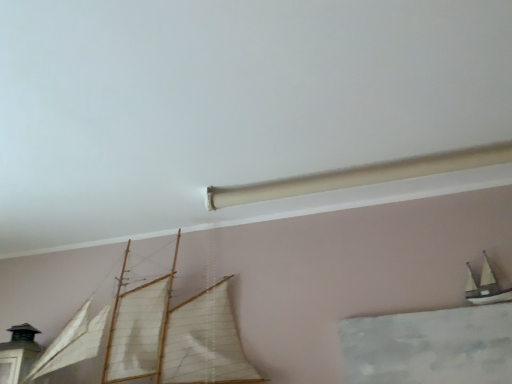
What do you see at coordinates (485, 286) in the screenshot? I see `white matte sailboat at upper right, placed as the second boat when sorted from left to right` at bounding box center [485, 286].

Locate an element on the screen. The height and width of the screenshot is (384, 512). white matte sailboat at upper right, placed as the second boat when sorted from left to right is located at coordinates click(485, 286).

What is the approximate width of wooden sailboat at center, the 1th boat positioned from the left?

The width of wooden sailboat at center, the 1th boat positioned from the left, is 9.74 inches.

Identify the location of wooden sailboat at center, the 2th boat viewed from the right. (174, 334).

Describe the element at coordinates (174, 334) in the screenshot. This screenshot has height=384, width=512. I see `wooden sailboat at center, the 2th boat viewed from the right` at that location.

Identify the location of white matte sailboat at upper right, placed as the second boat when sorted from left to right. The width and height of the screenshot is (512, 384). (485, 286).

Between white matte sailboat at upper right, arranged as the 1th boat when viewed from the right, and wooden sailboat at center, the 2th boat viewed from the right, which one appears on the right side from the viewer's perspective?

white matte sailboat at upper right, arranged as the 1th boat when viewed from the right, is more to the right.

Does white matte sailboat at upper right, placed as the second boat when sorted from left to right, lie behind wooden sailboat at center, the 2th boat viewed from the right?

Yes, the depth of white matte sailboat at upper right, placed as the second boat when sorted from left to right, is greater than that of wooden sailboat at center, the 2th boat viewed from the right.

Is point (473, 292) closer or farther from the camera than point (117, 379)?

Clearly, point (473, 292) is more distant from the camera than point (117, 379).

From the image's perspective, would you say white matte sailboat at upper right, arranged as the 1th boat when viewed from the right, is shown under wooden sailboat at center, the 1th boat positioned from the left?

Actually, white matte sailboat at upper right, arranged as the 1th boat when viewed from the right, appears above wooden sailboat at center, the 1th boat positioned from the left, in the image.

From a real-world perspective, relative to wooden sailboat at center, the 1th boat positioned from the left, is white matte sailboat at upper right, arranged as the 1th boat when viewed from the right, vertically above or below?

white matte sailboat at upper right, arranged as the 1th boat when viewed from the right, is below wooden sailboat at center, the 1th boat positioned from the left.

Which object is wider, white matte sailboat at upper right, placed as the second boat when sorted from left to right, or wooden sailboat at center, the 1th boat positioned from the left?

With larger width is wooden sailboat at center, the 1th boat positioned from the left.

Does white matte sailboat at upper right, arranged as the 1th boat when viewed from the right, have a lesser height compared to wooden sailboat at center, the 1th boat positioned from the left?

Indeed, white matte sailboat at upper right, arranged as the 1th boat when viewed from the right, has a lesser height compared to wooden sailboat at center, the 1th boat positioned from the left.

Considering the sizes of objects white matte sailboat at upper right, arranged as the 1th boat when viewed from the right, and wooden sailboat at center, the 1th boat positioned from the left, in the image provided, who is bigger, white matte sailboat at upper right, arranged as the 1th boat when viewed from the right, or wooden sailboat at center, the 1th boat positioned from the left,?

wooden sailboat at center, the 1th boat positioned from the left.

Choose the correct answer: Is white matte sailboat at upper right, arranged as the 1th boat when viewed from the right, inside wooden sailboat at center, the 1th boat positioned from the left, or outside it?

white matte sailboat at upper right, arranged as the 1th boat when viewed from the right, is spatially situated outside wooden sailboat at center, the 1th boat positioned from the left.

Is white matte sailboat at upper right, placed as the second boat when sorted from left to right, beside wooden sailboat at center, the 1th boat positioned from the left?

No, white matte sailboat at upper right, placed as the second boat when sorted from left to right, is not making contact with wooden sailboat at center, the 1th boat positioned from the left.

Is white matte sailboat at upper right, arranged as the 1th boat when viewed from the right, looking in the opposite direction of wooden sailboat at center, the 2th boat viewed from the right?

That's not correct — white matte sailboat at upper right, arranged as the 1th boat when viewed from the right, is not looking away from wooden sailboat at center, the 2th boat viewed from the right.

What's the angular difference between white matte sailboat at upper right, placed as the second boat when sorted from left to right, and wooden sailboat at center, the 2th boat viewed from the right,'s facing directions?

white matte sailboat at upper right, placed as the second boat when sorted from left to right, and wooden sailboat at center, the 2th boat viewed from the right, are facing 0.49 degrees away from each other.

Measure the distance from white matte sailboat at upper right, arranged as the 1th boat when viewed from the right, to wooden sailboat at center, the 2th boat viewed from the right.

The distance of white matte sailboat at upper right, arranged as the 1th boat when viewed from the right, from wooden sailboat at center, the 2th boat viewed from the right, is 3.62 feet.

You are a GUI agent. You are given a task and a screenshot of the screen. Output one action in this format:
    pyautogui.click(x=<x>, y=<y>)
    Task: Click on the boat in front of the white matte sailboat at upper right, arranged as the 1th boat when viewed from the right
    The height and width of the screenshot is (384, 512).
    Given the screenshot: What is the action you would take?
    pyautogui.click(x=174, y=334)

Considering the relative positions of wooden sailboat at center, the 2th boat viewed from the right, and white matte sailboat at upper right, arranged as the 1th boat when viewed from the right, in the image provided, is wooden sailboat at center, the 2th boat viewed from the right, to the left or to the right of white matte sailboat at upper right, arranged as the 1th boat when viewed from the right,?

From the image, it's evident that wooden sailboat at center, the 2th boat viewed from the right, is to the left of white matte sailboat at upper right, arranged as the 1th boat when viewed from the right.

Which is in front, wooden sailboat at center, the 1th boat positioned from the left, or white matte sailboat at upper right, arranged as the 1th boat when viewed from the right?

wooden sailboat at center, the 1th boat positioned from the left, is closer to the camera.

Considering the points (215, 335) and (473, 280), which point is in front, point (215, 335) or point (473, 280)?

Point (473, 280)

From the image's perspective, who appears lower, wooden sailboat at center, the 1th boat positioned from the left, or white matte sailboat at upper right, arranged as the 1th boat when viewed from the right?

wooden sailboat at center, the 1th boat positioned from the left, appears lower in the image.

From a real-world perspective, is wooden sailboat at center, the 1th boat positioned from the left, above or below white matte sailboat at upper right, placed as the second boat when sorted from left to right?

From a real-world perspective, wooden sailboat at center, the 1th boat positioned from the left, is physically above white matte sailboat at upper right, placed as the second boat when sorted from left to right.

Can you confirm if wooden sailboat at center, the 2th boat viewed from the right, is thinner than white matte sailboat at upper right, placed as the second boat when sorted from left to right?

No, wooden sailboat at center, the 2th boat viewed from the right, is not thinner than white matte sailboat at upper right, placed as the second boat when sorted from left to right.

Who is taller, wooden sailboat at center, the 2th boat viewed from the right, or white matte sailboat at upper right, placed as the second boat when sorted from left to right?

Standing taller between the two is wooden sailboat at center, the 2th boat viewed from the right.

Is wooden sailboat at center, the 2th boat viewed from the right, bigger than white matte sailboat at upper right, placed as the second boat when sorted from left to right?

Correct, wooden sailboat at center, the 2th boat viewed from the right, is larger in size than white matte sailboat at upper right, placed as the second boat when sorted from left to right.

Is white matte sailboat at upper right, placed as the second boat when sorted from left to right, located within wooden sailboat at center, the 1th boat positioned from the left?

No.

Is wooden sailboat at center, the 2th boat viewed from the right, positioned far away from white matte sailboat at upper right, placed as the second boat when sorted from left to right?

wooden sailboat at center, the 2th boat viewed from the right, is positioned a significant distance from white matte sailboat at upper right, placed as the second boat when sorted from left to right.

Is wooden sailboat at center, the 2th boat viewed from the right, oriented away from white matte sailboat at upper right, placed as the second boat when sorted from left to right?

No, wooden sailboat at center, the 2th boat viewed from the right, is not facing the opposite direction of white matte sailboat at upper right, placed as the second boat when sorted from left to right.

What's the angular difference between wooden sailboat at center, the 1th boat positioned from the left, and white matte sailboat at upper right, placed as the second boat when sorted from left to right,'s facing directions?

0.49 degrees.

Could you measure the distance between wooden sailboat at center, the 1th boat positioned from the left, and white matte sailboat at upper right, placed as the second boat when sorted from left to right?

wooden sailboat at center, the 1th boat positioned from the left, and white matte sailboat at upper right, placed as the second boat when sorted from left to right, are 3.62 feet apart from each other.

The height and width of the screenshot is (384, 512). Identify the location of boat that is on the right side of wooden sailboat at center, the 1th boat positioned from the left. (485, 286).

At what (x,y) coordinates should I click in order to perform the action: click on boat beneath the wooden sailboat at center, the 2th boat viewed from the right (from a real-world perspective). Please return your answer as a coordinate pair (x, y). Looking at the image, I should click on (485, 286).

Identify the location of boat above the white matte sailboat at upper right, placed as the second boat when sorted from left to right (from a real-world perspective). This screenshot has height=384, width=512. (174, 334).